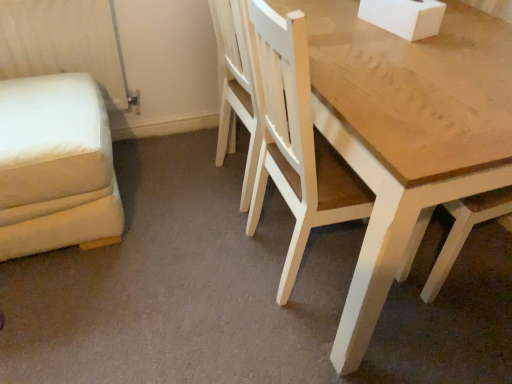
At what (x,y) coordinates should I click in order to perform the action: click on vacant area that lies between white fabric swivel chair at left and light wood chair at center. Please return your answer as a coordinate pair (x, y). The height and width of the screenshot is (384, 512). Looking at the image, I should click on (165, 236).